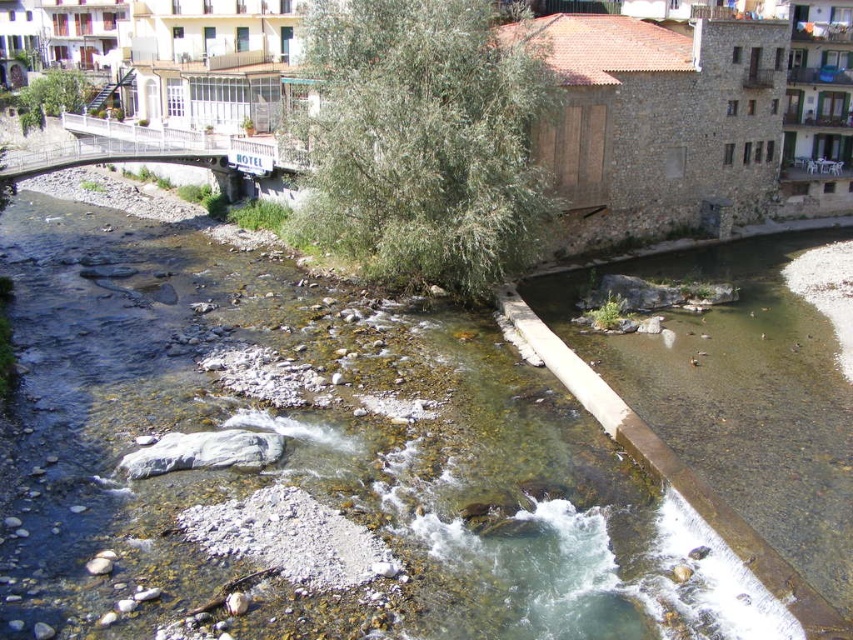
In the scene shown: Which is more to the left, green leafy tree at center or white metal bridge at upper left?

From the viewer's perspective, white metal bridge at upper left appears more on the left side.

Does green leafy tree at center have a lesser height compared to white metal bridge at upper left?

Incorrect, green leafy tree at center's height does not fall short of white metal bridge at upper left's.

Which is behind, point (448, 182) or point (276, 161)?

Positioned behind is point (276, 161).

Where is `green leafy tree at center`? This screenshot has height=640, width=853. green leafy tree at center is located at coordinates (421, 141).

Can you confirm if clear water at center is positioned to the right of green leafy tree at center?

In fact, clear water at center is to the left of green leafy tree at center.

Between clear water at center and green leafy tree at center, which one has less height?

clear water at center

Describe the element at coordinates (314, 464) in the screenshot. I see `clear water at center` at that location.

Locate an element on the screen. This screenshot has height=640, width=853. clear water at center is located at coordinates (314, 464).

Which is in front, point (273, 429) or point (151, 147)?

Point (273, 429)

Which is behind, point (12, 612) or point (90, 115)?

Point (90, 115)

Does point (250, 269) come behind point (219, 164)?

No, it is in front of (219, 164).

At what (x,y) coordinates should I click in order to perform the action: click on clear water at center. Please return your answer as a coordinate pair (x, y). The width and height of the screenshot is (853, 640). Looking at the image, I should click on (314, 464).